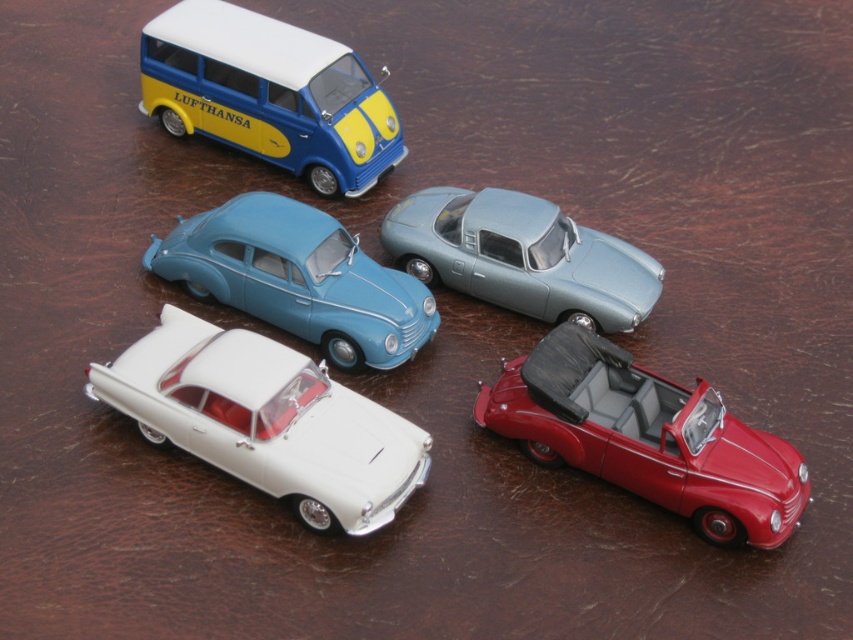
You are a collector who wants to display these cars in a row from largest to smallest. Given that you have the white glossy sedan at center and the satin silver car at upper center, which should come first?

The white glossy sedan at center should come first in the row since it has a larger size compared to the satin silver car at upper center.